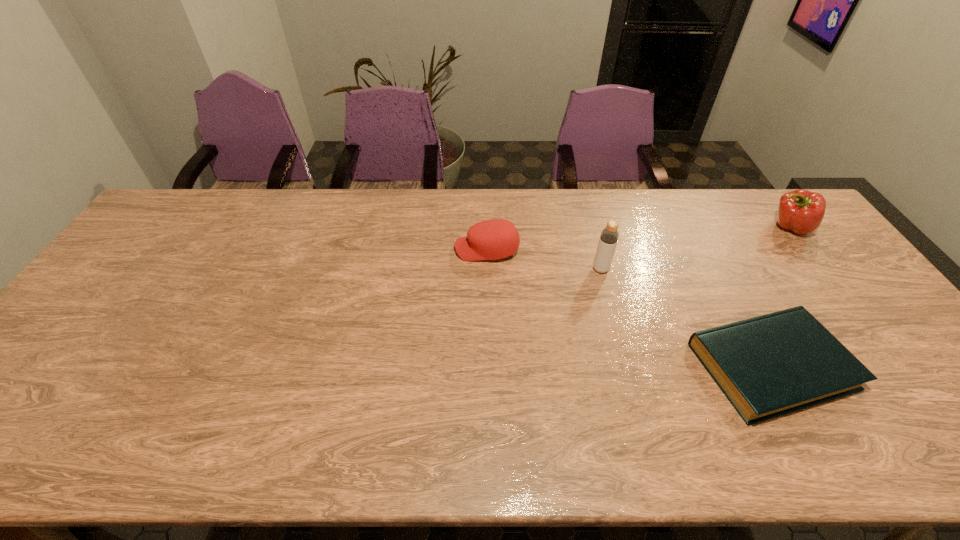
Image resolution: width=960 pixels, height=540 pixels. Identify the location of free space in the image that satisfies the following two spatial constraints: 1. on the front-facing side of the tallest object; 2. on the left side of the cap. (487, 269).

Where is `free space that satisfies the following two spatial constraints: 1. on the front side of the bottle; 2. on the left side of the book`? The image size is (960, 540). free space that satisfies the following two spatial constraints: 1. on the front side of the bottle; 2. on the left side of the book is located at coordinates [x=627, y=366].

Find the location of `vacant space that satisfies the following two spatial constraints: 1. on the front-facing side of the third tallest object; 2. on the left side of the book`. vacant space that satisfies the following two spatial constraints: 1. on the front-facing side of the third tallest object; 2. on the left side of the book is located at coordinates (489, 366).